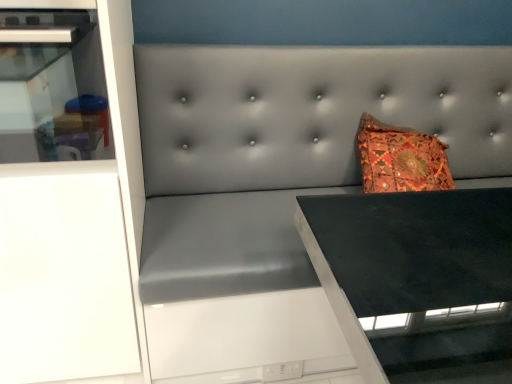
Question: Could you tell me if white matte cabinet at left is facing white glossy cabinet at left?

Choices:
 (A) yes
 (B) no

Answer: (A)

Question: From a real-world perspective, is white matte cabinet at left beneath white glossy cabinet at left?

Choices:
 (A) no
 (B) yes

Answer: (B)

Question: From the image's perspective, is white matte cabinet at left above white glossy cabinet at left?

Choices:
 (A) yes
 (B) no

Answer: (B)

Question: Is white matte cabinet at left smaller than white glossy cabinet at left?

Choices:
 (A) no
 (B) yes

Answer: (A)

Question: From a real-world perspective, is white matte cabinet at left on white glossy cabinet at left?

Choices:
 (A) no
 (B) yes

Answer: (A)

Question: Is white matte cabinet at left closer to the viewer compared to white glossy cabinet at left?

Choices:
 (A) yes
 (B) no

Answer: (B)

Question: From a real-world perspective, does white glossy cabinet at left sit lower than white matte cabinet at left?

Choices:
 (A) no
 (B) yes

Answer: (A)

Question: Does white glossy cabinet at left come behind white matte cabinet at left?

Choices:
 (A) no
 (B) yes

Answer: (A)

Question: From the image's perspective, is white glossy cabinet at left beneath white matte cabinet at left?

Choices:
 (A) yes
 (B) no

Answer: (B)

Question: From the image's perspective, does white glossy cabinet at left appear higher than white matte cabinet at left?

Choices:
 (A) no
 (B) yes

Answer: (B)

Question: From a real-world perspective, is white glossy cabinet at left on top of white matte cabinet at left?

Choices:
 (A) no
 (B) yes

Answer: (B)

Question: Is white glossy cabinet at left touching white matte cabinet at left?

Choices:
 (A) yes
 (B) no

Answer: (B)

Question: Considering the positions of white matte cabinet at left and white glossy cabinet at left in the image, is white matte cabinet at left taller or shorter than white glossy cabinet at left?

Choices:
 (A) tall
 (B) short

Answer: (A)